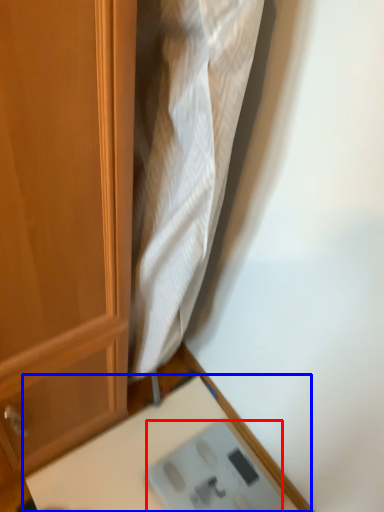
Question: Among these objects, which one is farthest to the camera, scale (highlighted by a red box) or table (highlighted by a blue box)?

Choices:
 (A) scale
 (B) table

Answer: (A)